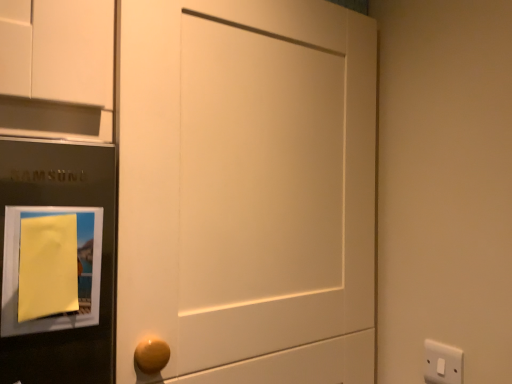
The height and width of the screenshot is (384, 512). Describe the element at coordinates (51, 268) in the screenshot. I see `yellow matte paper at left` at that location.

This screenshot has width=512, height=384. I want to click on yellow matte paper at left, so click(51, 268).

In order to face yellow matte paper at left, should I rotate leftwards or rightwards?

You should look left and rotate roughly 24.762 degrees.

What is the approximate height of white plastic light switch at lower right?

white plastic light switch at lower right is 3.57 inches tall.

Image resolution: width=512 pixels, height=384 pixels. What do you see at coordinates (442, 363) in the screenshot?
I see `white plastic light switch at lower right` at bounding box center [442, 363].

Find the location of `white plastic light switch at lower right`. white plastic light switch at lower right is located at coordinates (442, 363).

The width and height of the screenshot is (512, 384). I want to click on yellow matte paper at left, so click(x=51, y=268).

Visually, is white plastic light switch at lower right positioned to the left or to the right of yellow matte paper at left?

Clearly, white plastic light switch at lower right is on the right of yellow matte paper at left in the image.

Is the position of white plastic light switch at lower right more distant than that of yellow matte paper at left?

Yes, white plastic light switch at lower right is behind yellow matte paper at left.

Is point (430, 380) closer or farther from the camera than point (53, 215)?

Point (430, 380).

From the image's perspective, which is above, white plastic light switch at lower right or yellow matte paper at left?

yellow matte paper at left appears higher in the image.

From a real-world perspective, is white plastic light switch at lower right physically below yellow matte paper at left?

Yes, from a real-world perspective, white plastic light switch at lower right is beneath yellow matte paper at left.

Can you confirm if white plastic light switch at lower right is thinner than yellow matte paper at left?

Yes.

Who is shorter, white plastic light switch at lower right or yellow matte paper at left?

With less height is white plastic light switch at lower right.

Considering the sizes of white plastic light switch at lower right and yellow matte paper at left in the image, is white plastic light switch at lower right bigger or smaller than yellow matte paper at left?

Clearly, white plastic light switch at lower right is smaller in size than yellow matte paper at left.

Is white plastic light switch at lower right not inside yellow matte paper at left?

Yes, white plastic light switch at lower right is outside of yellow matte paper at left.

Would you consider white plastic light switch at lower right to be distant from yellow matte paper at left?

No.

Could you tell me if white plastic light switch at lower right is turned towards yellow matte paper at left?

Yes, white plastic light switch at lower right faces towards yellow matte paper at left.

Can you tell me how much white plastic light switch at lower right and yellow matte paper at left differ in facing direction?

90.2 degrees separate the facing orientations of white plastic light switch at lower right and yellow matte paper at left.

This screenshot has width=512, height=384. What are the coordinates of `picture frame that appears above the white plastic light switch at lower right (from a real-world perspective)` in the screenshot? It's located at (51, 268).

Considering the relative positions of yellow matte paper at left and white plastic light switch at lower right in the image provided, is yellow matte paper at left to the left of white plastic light switch at lower right from the viewer's perspective?

Correct, you'll find yellow matte paper at left to the left of white plastic light switch at lower right.

Which is behind, yellow matte paper at left or white plastic light switch at lower right?

white plastic light switch at lower right is further away from the camera.

Does point (84, 310) come farther from viewer compared to point (453, 376)?

That is False.

From the image's perspective, is yellow matte paper at left under white plastic light switch at lower right?

No, from the image's perspective, yellow matte paper at left is not below white plastic light switch at lower right.

From a real-world perspective, does yellow matte paper at left sit lower than white plastic light switch at lower right?

No.

Consider the image. Considering the relative sizes of yellow matte paper at left and white plastic light switch at lower right in the image provided, is yellow matte paper at left wider than white plastic light switch at lower right?

Yes, yellow matte paper at left is wider than white plastic light switch at lower right.

Does yellow matte paper at left have a lesser height compared to white plastic light switch at lower right?

In fact, yellow matte paper at left may be taller than white plastic light switch at lower right.

Between yellow matte paper at left and white plastic light switch at lower right, which one has larger size?

yellow matte paper at left.

Which is correct: yellow matte paper at left is inside white plastic light switch at lower right, or outside of it?

yellow matte paper at left is not inside white plastic light switch at lower right, it's outside.

Can you see yellow matte paper at left touching white plastic light switch at lower right?

There is a gap between yellow matte paper at left and white plastic light switch at lower right.

Is yellow matte paper at left facing away from white plastic light switch at lower right?

No, yellow matte paper at left's orientation is not away from white plastic light switch at lower right.

Can you tell me how much yellow matte paper at left and white plastic light switch at lower right differ in facing direction?

90.2 degrees.

Measure the distance between yellow matte paper at left and white plastic light switch at lower right.

yellow matte paper at left and white plastic light switch at lower right are 28.94 inches apart from each other.

The image size is (512, 384). I want to click on light switch below the yellow matte paper at left (from a real-world perspective), so click(442, 363).

Where is `picture frame on the left of white plastic light switch at lower right`? This screenshot has height=384, width=512. picture frame on the left of white plastic light switch at lower right is located at coordinates (51, 268).

Image resolution: width=512 pixels, height=384 pixels. Identify the location of picture frame that is in front of the white plastic light switch at lower right. [51, 268].